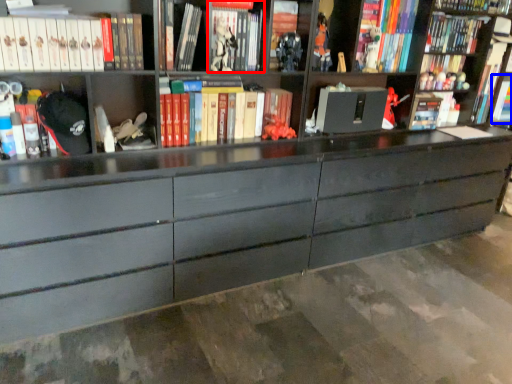
Question: Which object appears closest to the camera in this image, book (highlighted by a red box) or book (highlighted by a blue box)?

Choices:
 (A) book
 (B) book

Answer: (A)